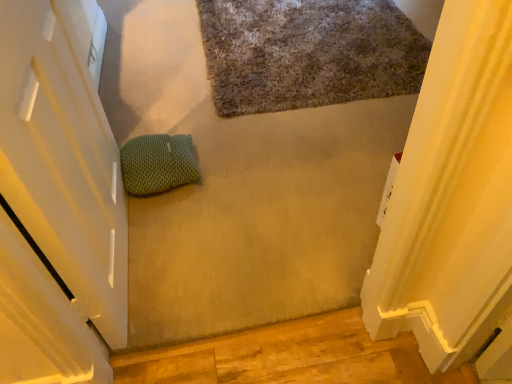
Question: From the image's perspective, is textured gray bath mat at upper center located above or below green mesh pillow at center?

Choices:
 (A) below
 (B) above

Answer: (B)

Question: In the image, is textured gray bath mat at upper center on the left side or the right side of green mesh pillow at center?

Choices:
 (A) left
 (B) right

Answer: (B)

Question: Is textured gray bath mat at upper center wider or thinner than green mesh pillow at center?

Choices:
 (A) thin
 (B) wide

Answer: (B)

Question: Looking at the image, does green mesh pillow at center seem bigger or smaller compared to textured gray bath mat at upper center?

Choices:
 (A) small
 (B) big

Answer: (A)

Question: In the image, is green mesh pillow at center on the left side or the right side of textured gray bath mat at upper center?

Choices:
 (A) right
 (B) left

Answer: (B)

Question: Considering the positions of green mesh pillow at center and textured gray bath mat at upper center in the image, is green mesh pillow at center taller or shorter than textured gray bath mat at upper center?

Choices:
 (A) short
 (B) tall

Answer: (B)

Question: Would you say green mesh pillow at center is inside or outside textured gray bath mat at upper center?

Choices:
 (A) inside
 (B) outside

Answer: (B)